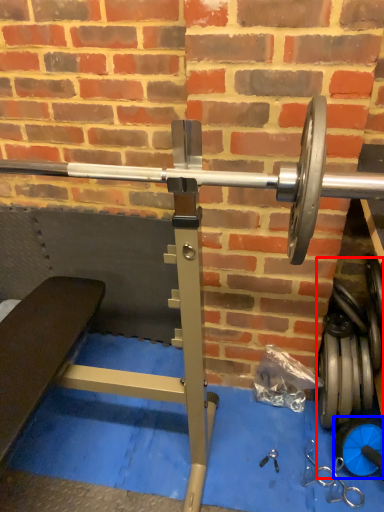
Question: Which object is further to the camera taking this photo, dumbbell (highlighted by a red box) or dumbbell (highlighted by a blue box)?

Choices:
 (A) dumbbell
 (B) dumbbell

Answer: (A)